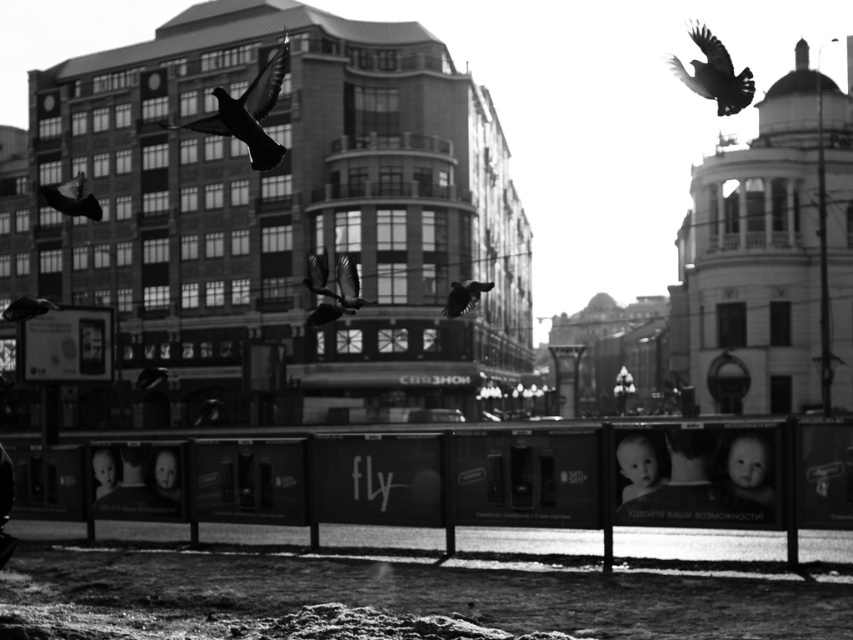
You are a photographer reviewing a black and white photo of an urban scene with billboards and pigeons. You notice a point marked at coordinates (247,113). Based on the scene description, what object does this point most likely belong to?

The point at (247,113) is on the dark feathered bird at upper center.

You are a photographer standing in the middle of the scene. You want to capture both the silhouette feathered bird at center and the silvery metallic bird at center in a single shot. Given that your camera has a maximum focus range of 10 meters, will you be able to include both birds in your photo?

The silhouette feathered bird at center and the silvery metallic bird at center are 9.47 meters apart from each other. Since the distance between them is within the camera maximum focus range of 10 meters, you can include both birds in your photo.

You are a photographer trying to capture a photo of both the dark feathered bird at upper center and the silvery metallic bird at center. Based on their positions, which bird would appear larger in the photo?

The dark feathered bird at upper center would appear larger in the photo because it is much taller than the silvery metallic bird at center.